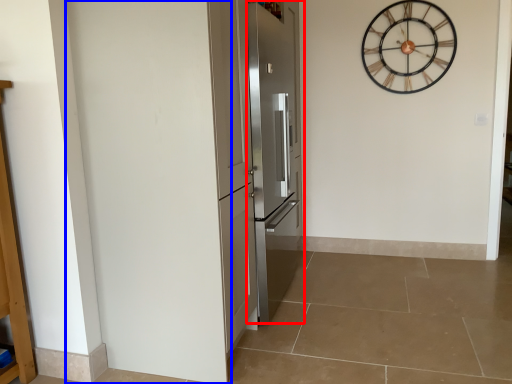
Question: Among these objects, which one is farthest to the camera, door (highlighted by a red box) or door (highlighted by a blue box)?

Choices:
 (A) door
 (B) door

Answer: (A)